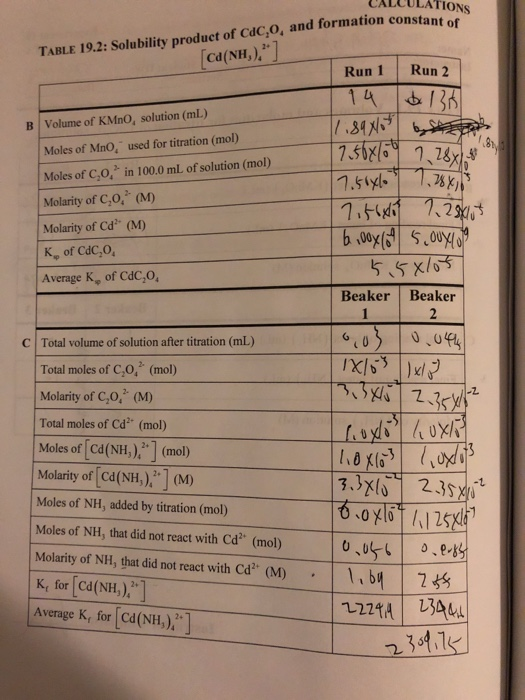
This screenshot has height=700, width=525. What are the coordinates of `column` in the screenshot? It's located at (178, 90), (360, 69), (440, 68).